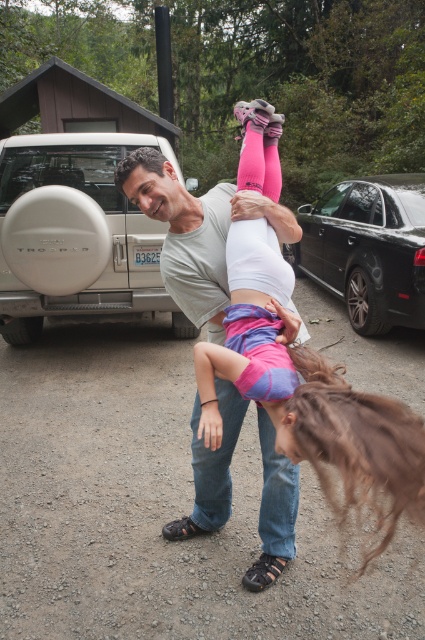
Question: Among these objects, which one is nearest to the camera?

Choices:
 (A) white matte spare tire at left
 (B) black metallic car at right

Answer: (A)

Question: Does matte gray shirt at center have a larger size compared to black metallic car at right?

Choices:
 (A) no
 (B) yes

Answer: (A)

Question: Considering the real-world distances, which object is farthest from the matte gray shirt at center?

Choices:
 (A) pink fabric pants at center
 (B) white matte spare tire at left
 (C) black metallic car at right

Answer: (C)

Question: Does white matte spare tire at left come in front of black metallic car at right?

Choices:
 (A) yes
 (B) no

Answer: (A)

Question: Based on their relative distances, which object is farther from the matte gray shirt at center?

Choices:
 (A) pink fabric pants at center
 (B) white matte spare tire at left
 (C) black metallic car at right

Answer: (C)

Question: Does white matte spare tire at left appear over black metallic car at right?

Choices:
 (A) no
 (B) yes

Answer: (A)